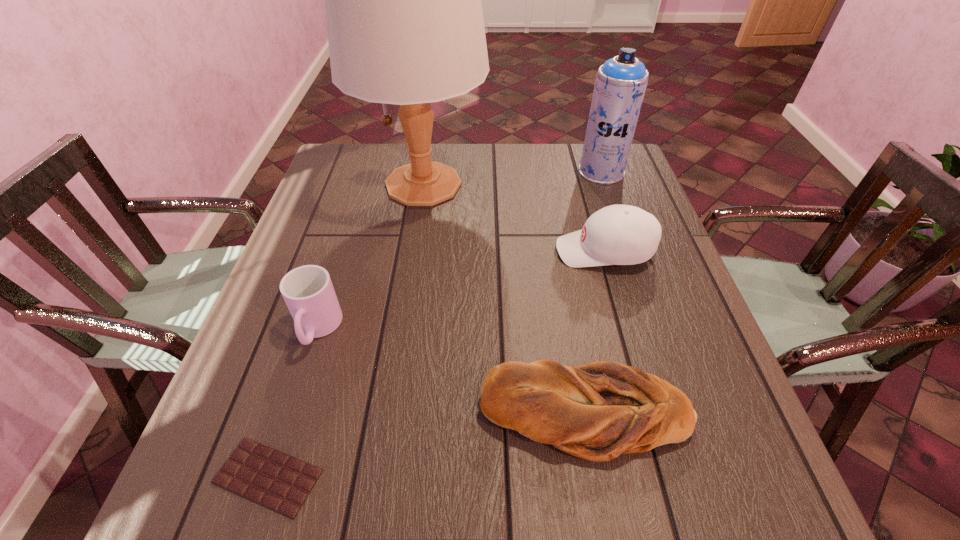
Find the location of a particular element. The height and width of the screenshot is (540, 960). the tallest object is located at coordinates (405, 25).

Where is `aerosol can`? aerosol can is located at coordinates point(620,84).

The image size is (960, 540). Identify the location of the third nearest object. (308, 292).

You are a GUI agent. You are given a task and a screenshot of the screen. Output one action in this format:
    pyautogui.click(x=<x>, y=<y>)
    Task: Click on the fourth nearest object
    Image resolution: width=960 pixels, height=540 pixels.
    Given the screenshot: What is the action you would take?
    (x=617, y=234)

Where is `bread`? bread is located at coordinates (596, 411).

Where is `chocolate bar`? chocolate bar is located at coordinates (278, 481).

Where is `free location located 0.210m on the front of the tallest object`? The image size is (960, 540). free location located 0.210m on the front of the tallest object is located at coordinates (408, 284).

The height and width of the screenshot is (540, 960). In order to click on free location located on the left of the second tallest object in this screenshot , I will do `click(548, 172)`.

In order to click on vacant space located with the handle on the side of the fourth farthest object in this screenshot , I will do `click(283, 436)`.

The image size is (960, 540). Identify the location of free location located 0.130m on the front-facing side of the baseball cap. (503, 251).